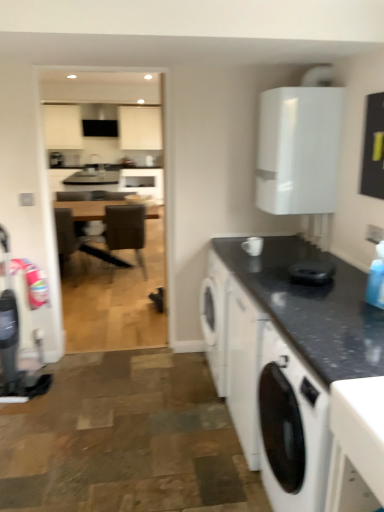
Find the location of a particular element. The height and width of the screenshot is (512, 384). vacant area that is in front of black glossy coffee cup at center, which is the 1th appliance from front to back is located at coordinates (316, 295).